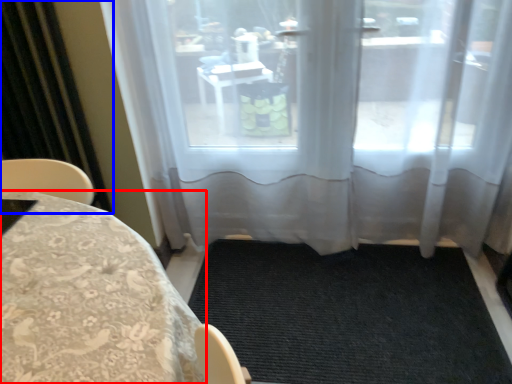
Question: Which point is further to the camera, furniture (highlighted by a red box) or curtain (highlighted by a blue box)?

Choices:
 (A) furniture
 (B) curtain

Answer: (B)